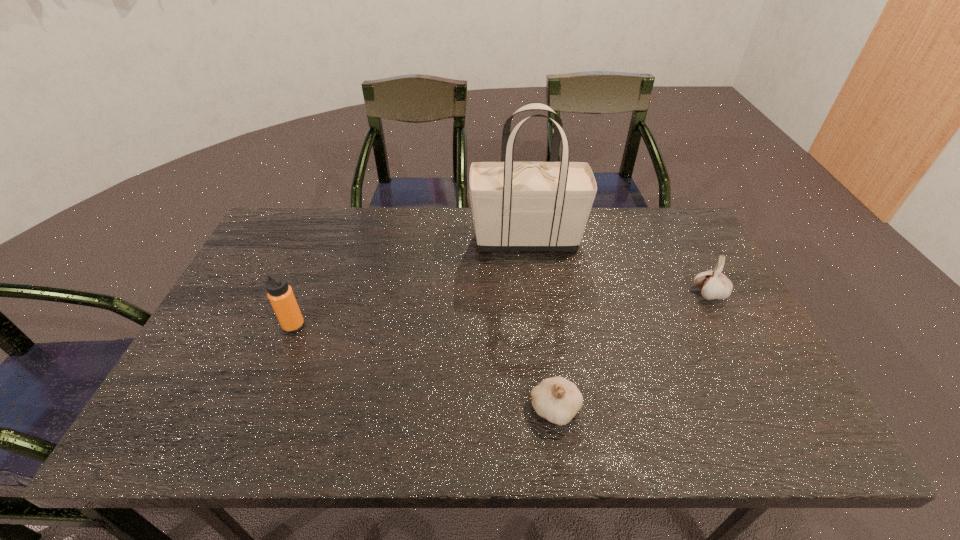
Locate an element on the screen. blank space located 0.210m with handles facing forward on the farthest object is located at coordinates (405, 239).

You are a GUI agent. You are given a task and a screenshot of the screen. Output one action in this format:
    pyautogui.click(x=<x>, y=<y>)
    Task: Click on the vacant space located 0.360m on the back of the third shortest object
    The height and width of the screenshot is (540, 960).
    Given the screenshot: What is the action you would take?
    pyautogui.click(x=330, y=234)

The width and height of the screenshot is (960, 540). In order to click on free space located on the left of the farther garlic in this screenshot , I will do `click(596, 294)`.

Locate an element on the screen. The height and width of the screenshot is (540, 960). free point located 0.210m on the left of the shorter garlic is located at coordinates (434, 409).

I want to click on object at the far edge, so click(517, 206).

Find the location of `object that is at the near edge`. object that is at the near edge is located at coordinates 558,400.

The height and width of the screenshot is (540, 960). What are the coordinates of `object present at the right edge` in the screenshot? It's located at (713, 284).

In the image, there is a desktop. Identify the location of vacant space at the far edge. Image resolution: width=960 pixels, height=540 pixels. (414, 211).

Find the location of `free space at the near edge of the desktop`. free space at the near edge of the desktop is located at coordinates (354, 415).

In order to click on blank space at the right edge of the desktop in this screenshot , I will do `click(717, 370)`.